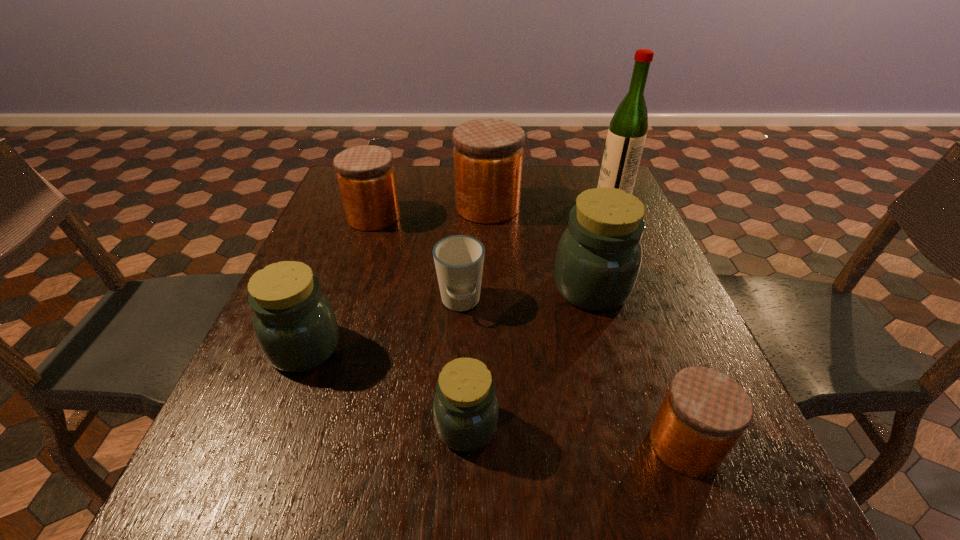
Where is `liquor`? liquor is located at coordinates (626, 136).

The image size is (960, 540). What are the coordinates of `the tallest object` in the screenshot? It's located at (626, 136).

You are a GUI agent. You are given a task and a screenshot of the screen. Output one action in this format:
    pyautogui.click(x=<x>, y=<y>)
    Task: Click on the biggest orange jar
    This screenshot has width=960, height=540.
    Given the screenshot: What is the action you would take?
    pyautogui.click(x=488, y=153)

At what (x,y) coordinates should I click in order to perform the action: click on the farthest green jar. Please return your answer as a coordinate pair (x, y). Image resolution: width=960 pixels, height=540 pixels. Looking at the image, I should click on (598, 259).

Locate an element on the screen. This screenshot has height=540, width=960. the third farthest jar is located at coordinates (598, 259).

Where is `the leftmost orange jar`? Image resolution: width=960 pixels, height=540 pixels. the leftmost orange jar is located at coordinates (366, 177).

You are a GUI agent. You are given a task and a screenshot of the screen. Output one action in this format:
    pyautogui.click(x=<x>, y=<y>)
    Task: Click on the fourth farthest jar
    This screenshot has height=540, width=960.
    Given the screenshot: What is the action you would take?
    pyautogui.click(x=294, y=323)

Where is `the second smallest green jar`? the second smallest green jar is located at coordinates (294, 323).

Locate an element on the screen. The width and height of the screenshot is (960, 540). white cup is located at coordinates (459, 259).

Image resolution: width=960 pixels, height=540 pixels. In order to click on the smallest green jar in this screenshot , I will do `click(465, 409)`.